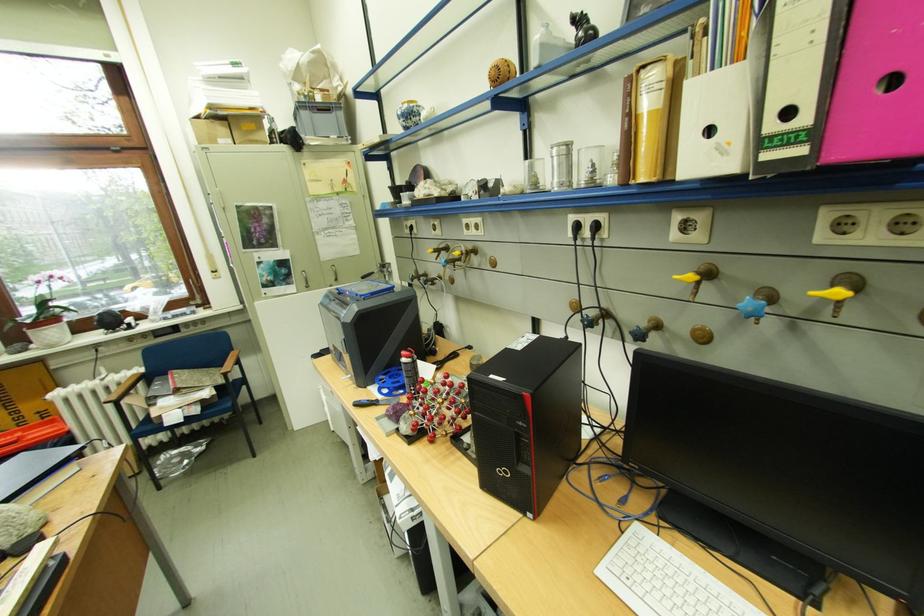
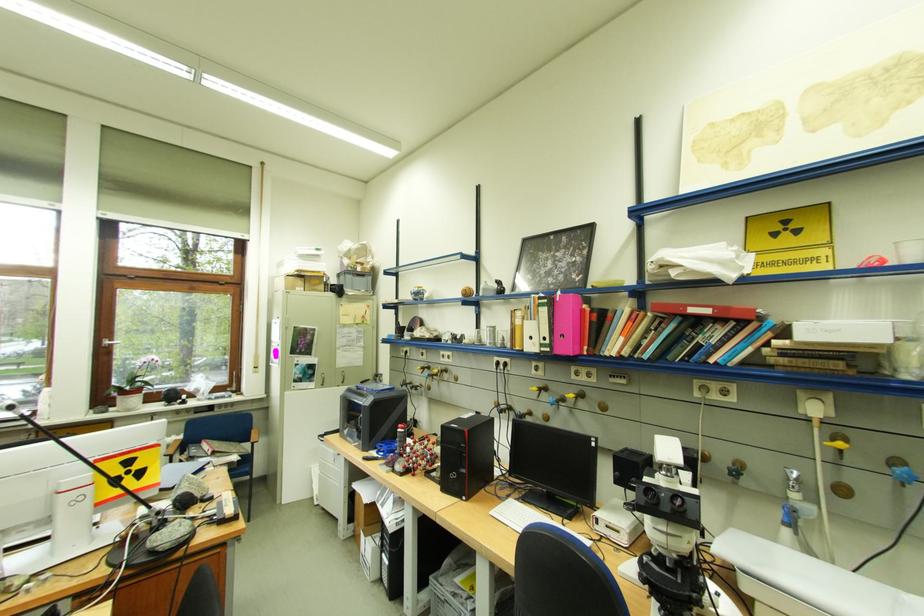
Where in the second image is the point corresponding to the point at 41,334 from the first image?

(130, 399)